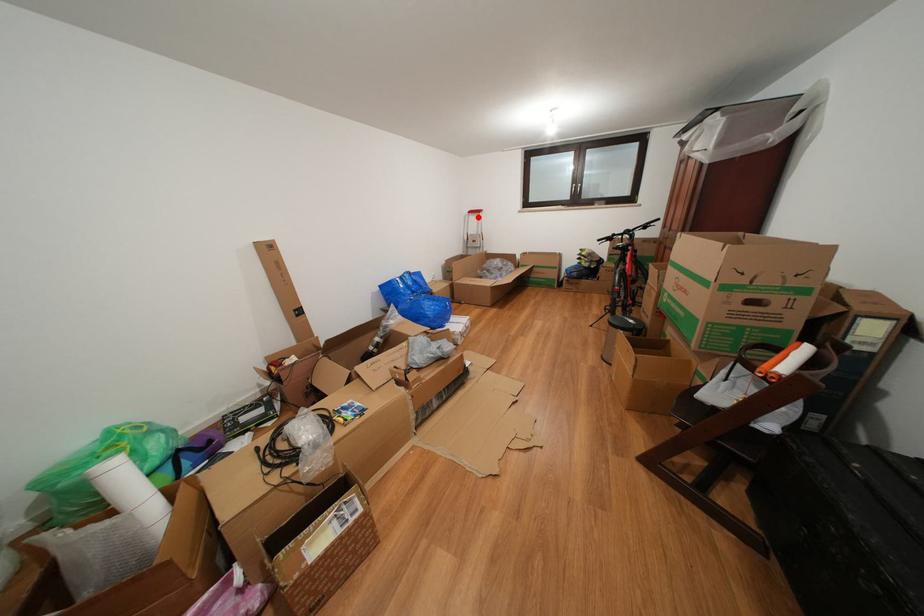
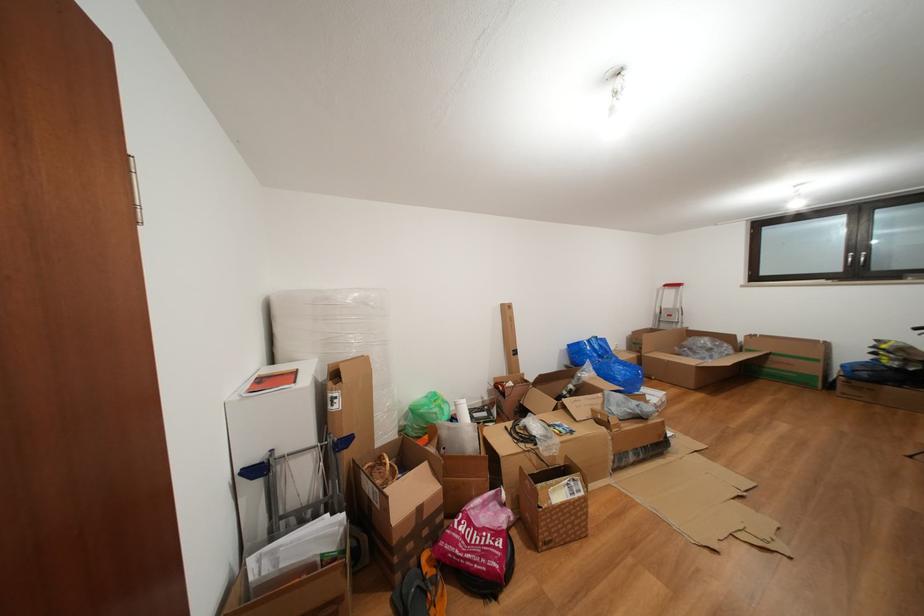
The point at the highlighted location is marked in the first image. Where is the corresponding point in the second image?

(674, 291)